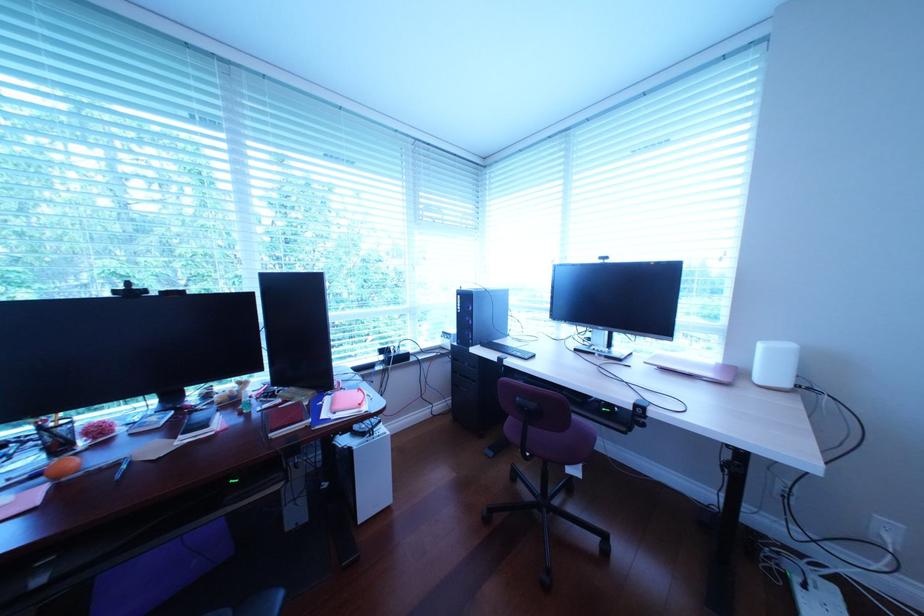
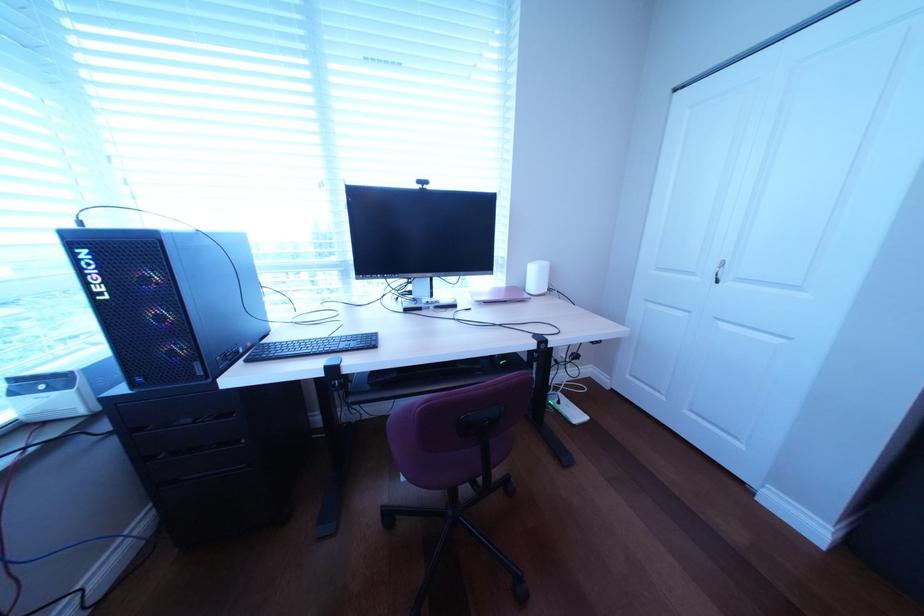
Question: The camera is either moving clockwise (left) or counter-clockwise (right) around the object. The first image is from the beginning of the video and the second image is from the end. Is the camera moving left or right when shooting the video?

Choices:
 (A) Left
 (B) Right

Answer: (A)